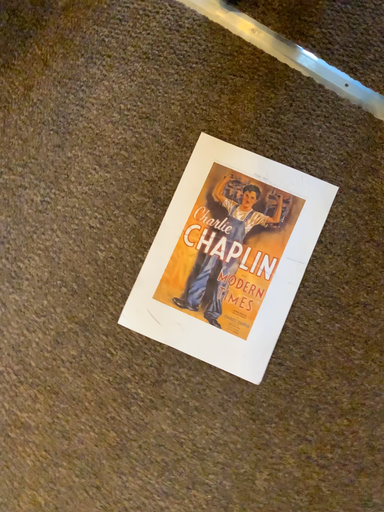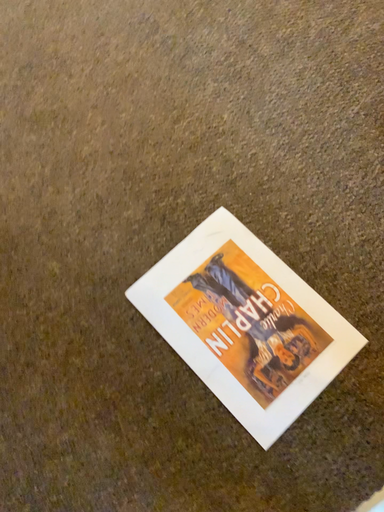
Question: Which way did the camera rotate in the video?

Choices:
 (A) rotated downward
 (B) rotated upward

Answer: (B)